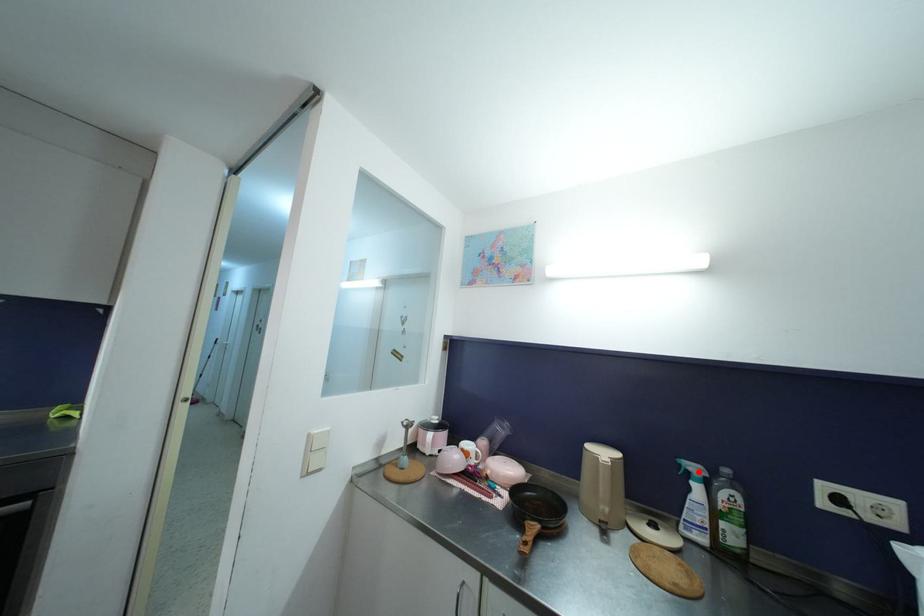
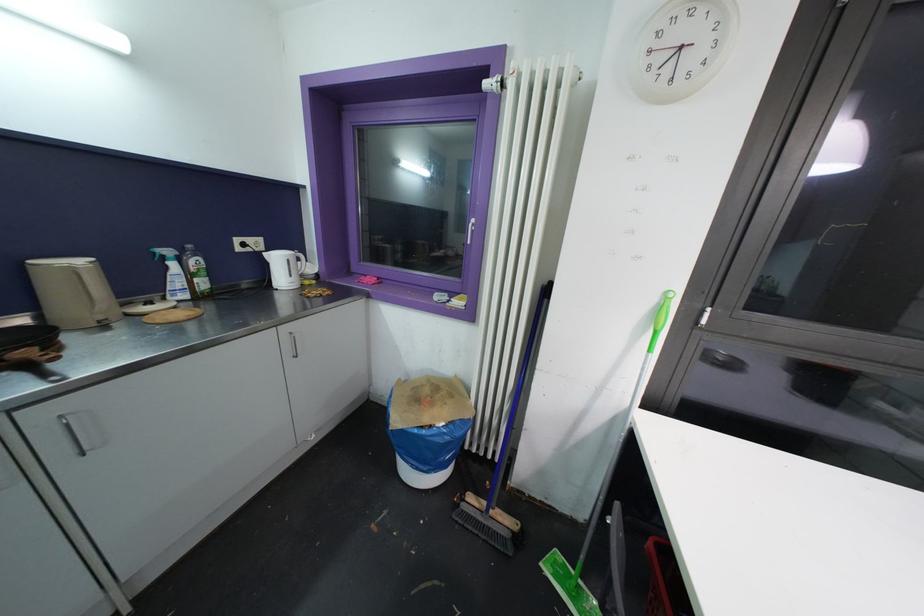
The point at the highlighted location is marked in the first image. Where is the corresponding point in the second image?

(171, 254)